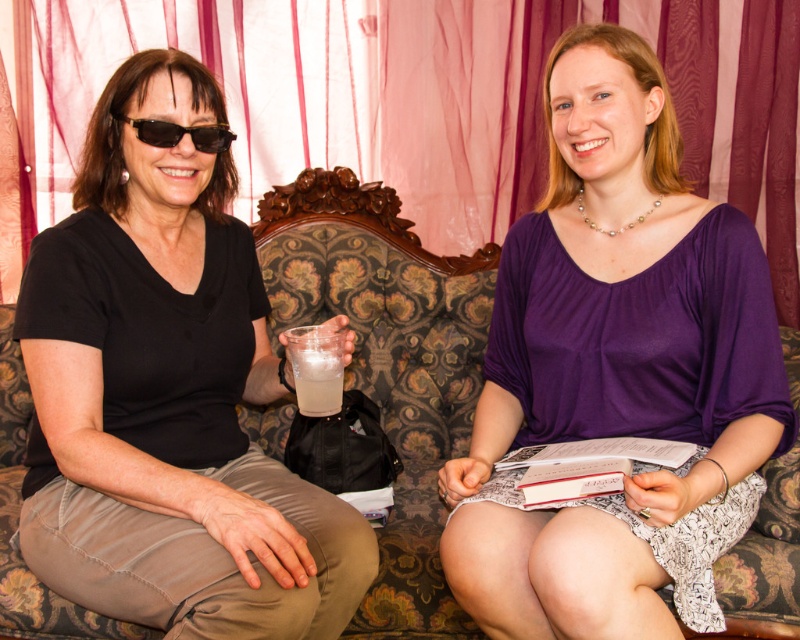
Question: Is pink sheer curtain at upper center closer to the viewer compared to patterned fabric couch at center?

Choices:
 (A) yes
 (B) no

Answer: (B)

Question: Considering the relative positions of black matte shirt at left and pink sheer curtain at upper center in the image provided, where is black matte shirt at left located with respect to pink sheer curtain at upper center?

Choices:
 (A) above
 (B) below

Answer: (B)

Question: Among these objects, which one is nearest to the camera?

Choices:
 (A) black plastic sunglasses at left
 (B) clear plastic cup at center
 (C) pink sheer curtain at upper center

Answer: (A)

Question: Which object is the closest to the pink sheer curtain at upper center?

Choices:
 (A) black matte shirt at left
 (B) patterned fabric couch at center
 (C) purple satin dress at center
 (D) clear plastic cup at center

Answer: (B)

Question: Which point is farther to the camera?

Choices:
 (A) purple satin dress at center
 (B) black matte shirt at left
 (C) patterned fabric couch at center

Answer: (C)

Question: Does black matte shirt at left appear over patterned fabric couch at center?

Choices:
 (A) no
 (B) yes

Answer: (B)